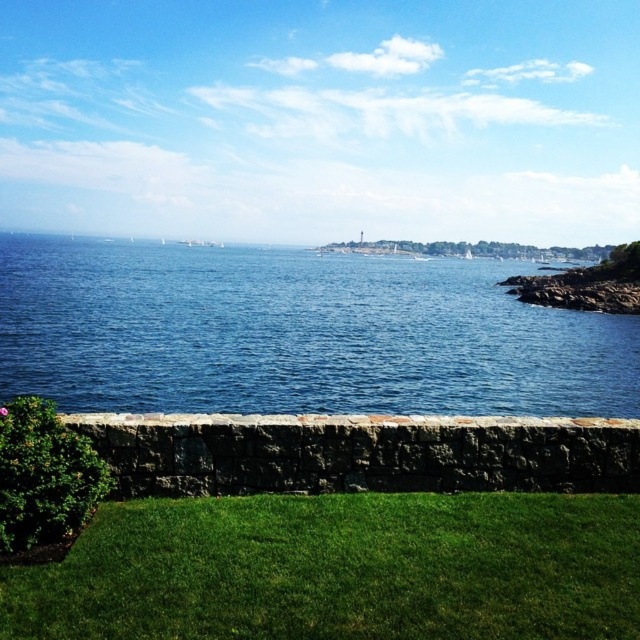
What do you see at coordinates (296, 333) in the screenshot? Image resolution: width=640 pixels, height=640 pixels. I see `blue water at center` at bounding box center [296, 333].

Which of these two, blue water at center or green grass at lower center, stands shorter?

green grass at lower center

The height and width of the screenshot is (640, 640). Describe the element at coordinates (296, 333) in the screenshot. I see `blue water at center` at that location.

Find the location of a particular element. This screenshot has width=640, height=640. blue water at center is located at coordinates (296, 333).